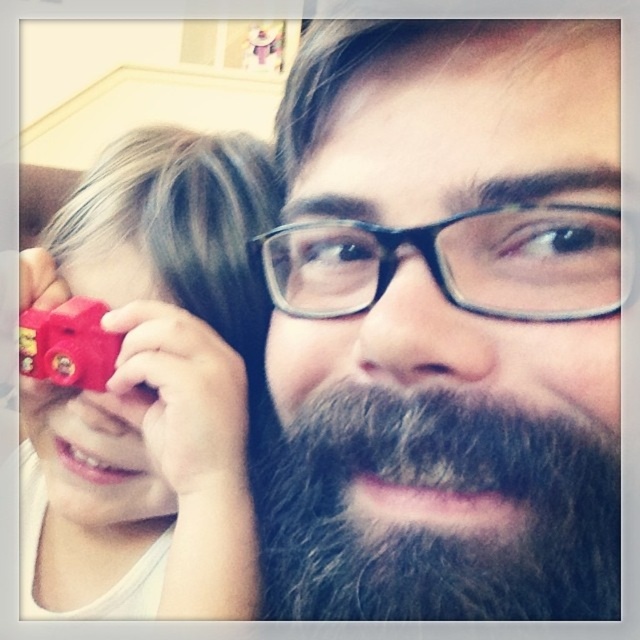
Question: Which point is closer to the camera?

Choices:
 (A) rubberized red toy camera at left
 (B) rubberized plastic train at left
 (C) dark brown beard at center
 (D) gray fuzzy beard at center

Answer: (C)

Question: Is rubberized red toy camera at left bigger than rubberized plastic train at left?

Choices:
 (A) yes
 (B) no

Answer: (A)

Question: Which of the following is the closest to the observer?

Choices:
 (A) (x=442, y=586)
 (B) (x=49, y=368)
 (C) (x=579, y=547)
 (D) (x=131, y=499)

Answer: (A)

Question: Can you confirm if dark brown beard at center is wider than gray fuzzy beard at center?

Choices:
 (A) yes
 (B) no

Answer: (A)

Question: Can you confirm if dark brown beard at center is positioned to the right of rubberized plastic train at left?

Choices:
 (A) no
 (B) yes

Answer: (B)

Question: Which is farther from the rubberized plastic train at left?

Choices:
 (A) dark brown beard at center
 (B) rubberized red toy camera at left
 (C) gray fuzzy beard at center

Answer: (A)